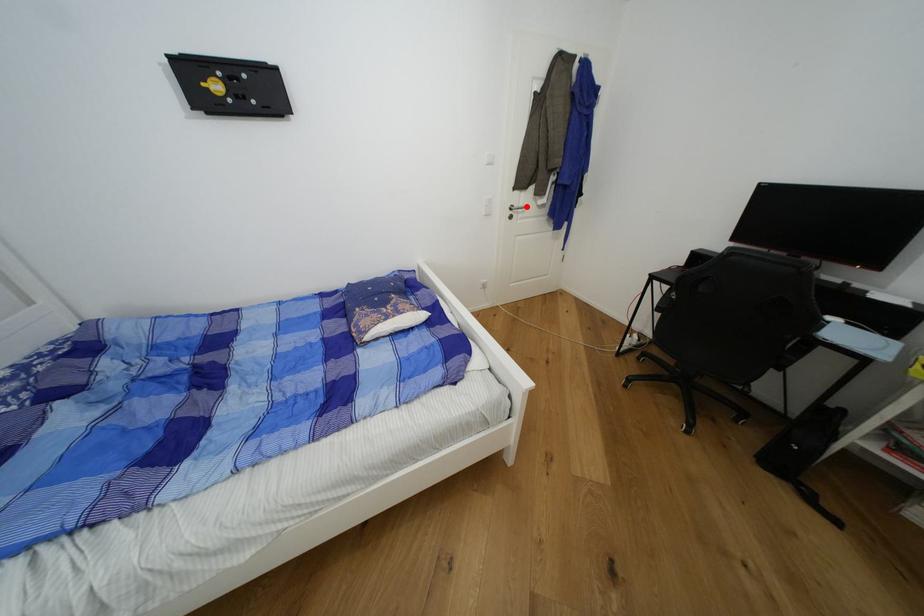
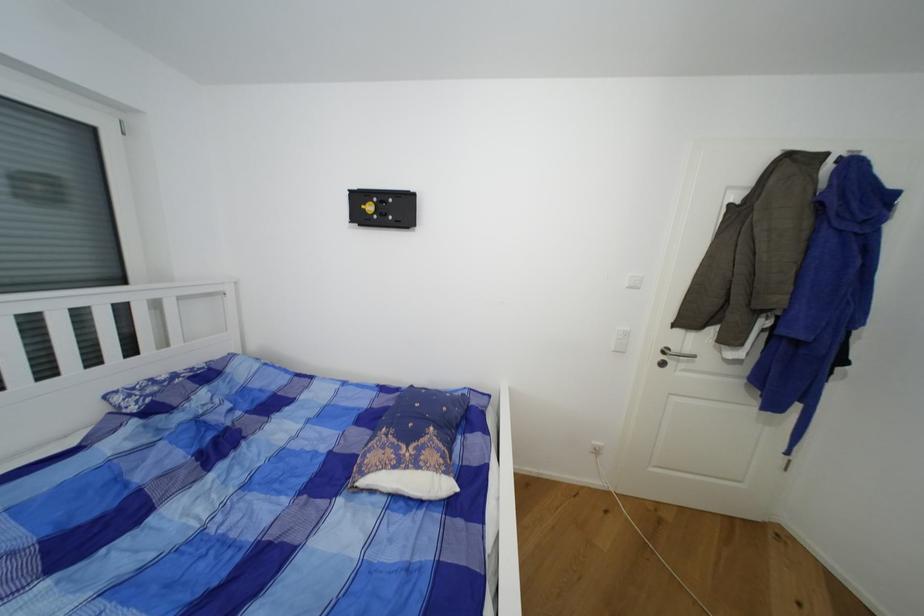
Locate, in the second image, the point that corresponds to the highlighted location in the first image.

(691, 352)